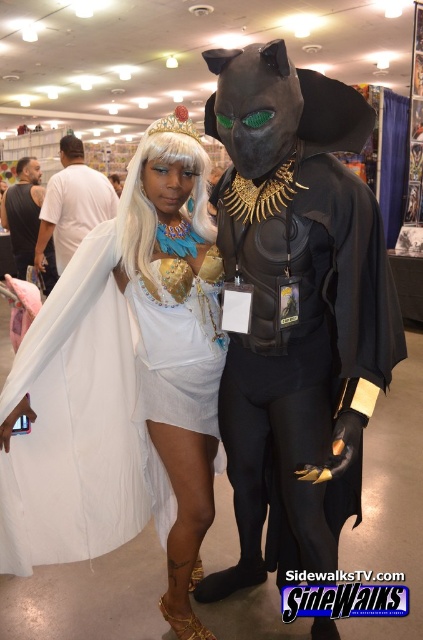
Question: Is white satin dress at center positioned behind white silky wig at center?

Choices:
 (A) yes
 (B) no

Answer: (B)

Question: Which point is farther to the camera?

Choices:
 (A) white fabric at left
 (B) white silky wig at center
 (C) black matte t-shirt at left

Answer: (C)

Question: Which point is closer to the camera?

Choices:
 (A) (73, 148)
 (B) (128, 536)
 (C) (14, 221)

Answer: (B)

Question: Which of the following is the closest to the observer?

Choices:
 (A) (40, 180)
 (B) (151, 145)
 (C) (63, 248)

Answer: (B)

Question: Considering the relative positions of white satin dress at center and white silky wig at center in the image provided, where is white satin dress at center located with respect to white silky wig at center?

Choices:
 (A) right
 (B) left

Answer: (B)

Question: Can you confirm if white satin dress at center is positioned above black matte t-shirt at left?

Choices:
 (A) yes
 (B) no

Answer: (B)